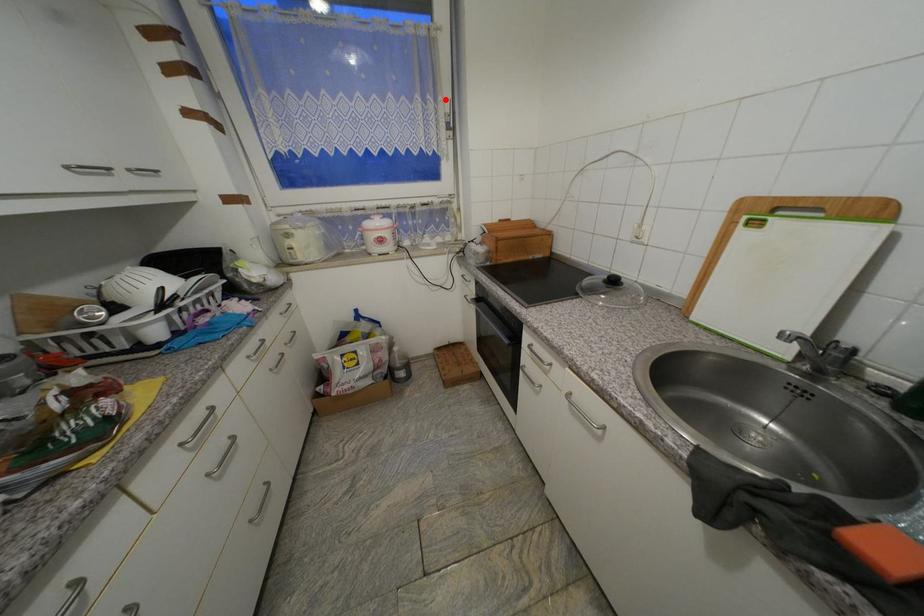
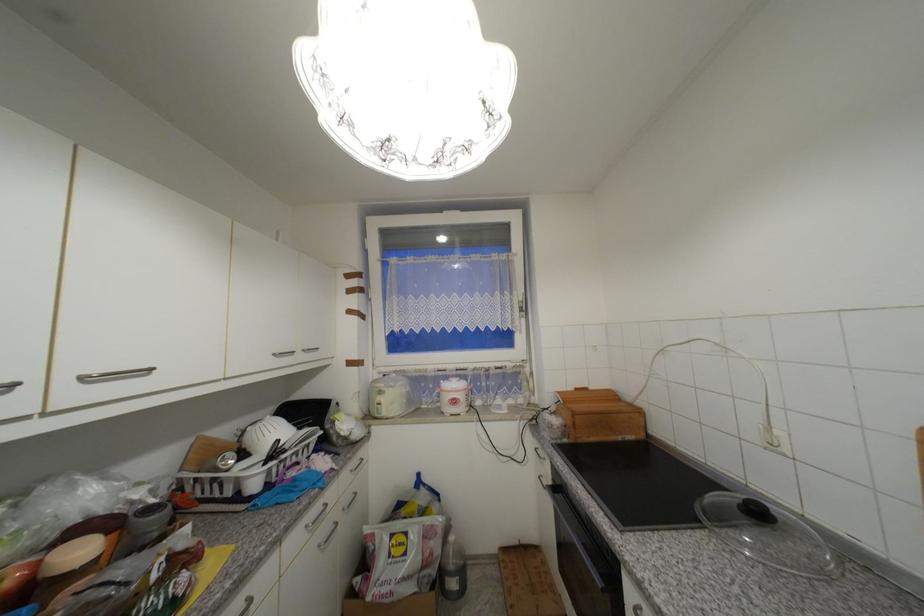
Find the pixel in the second image that matches the highlighted location in the first image.

(520, 294)